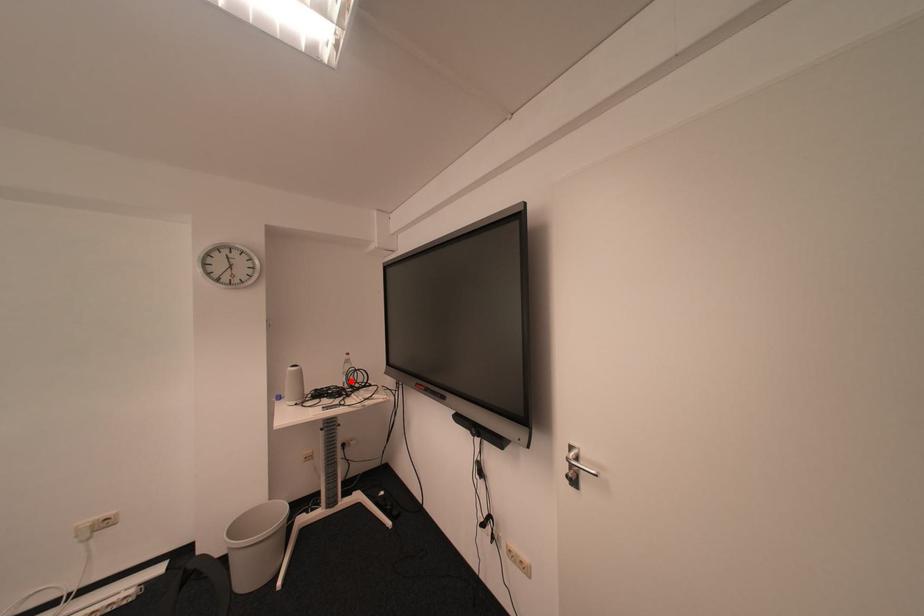
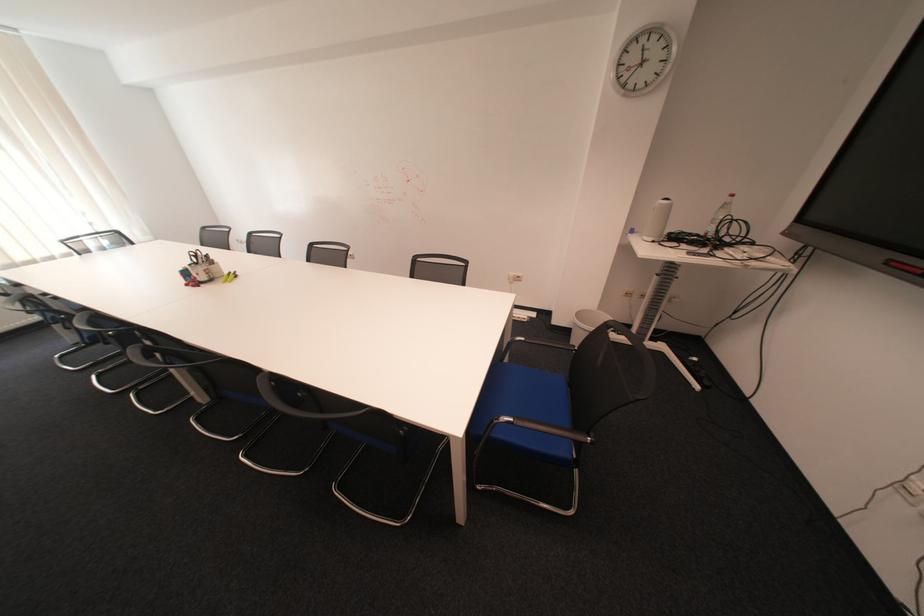
Where in the second image is the point corresponding to the highlighted location from the first image?

(714, 229)